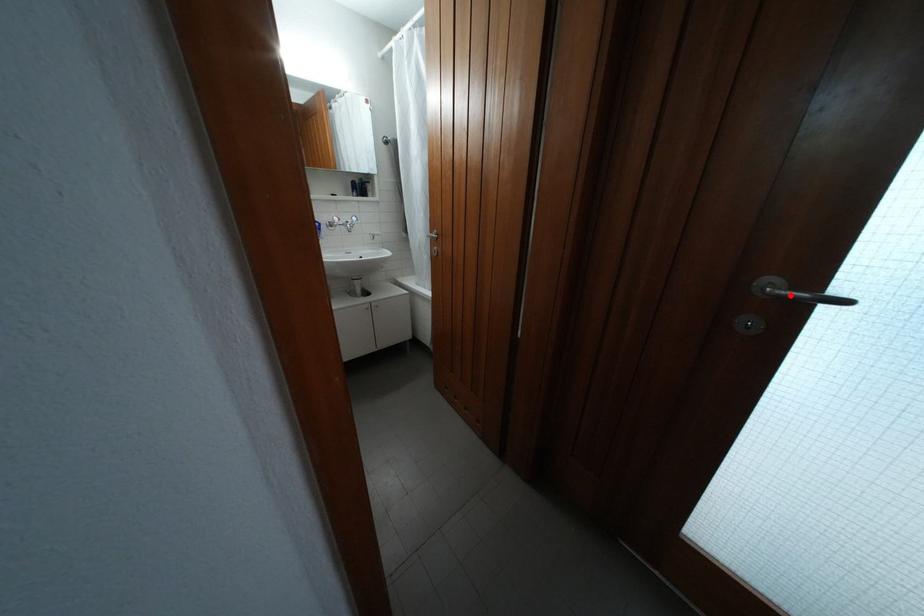
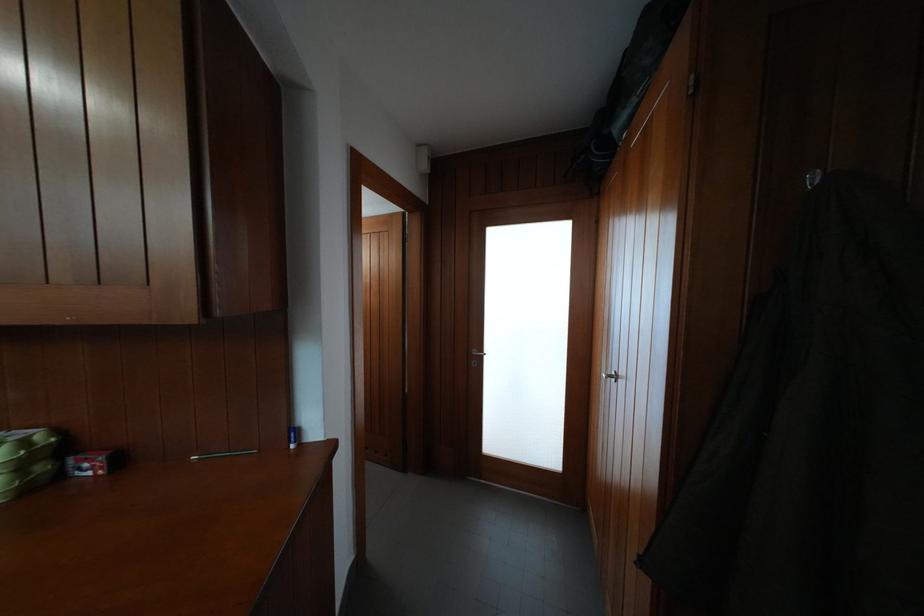
In the second image, find the point that corresponds to the highlighted location in the first image.

(484, 358)